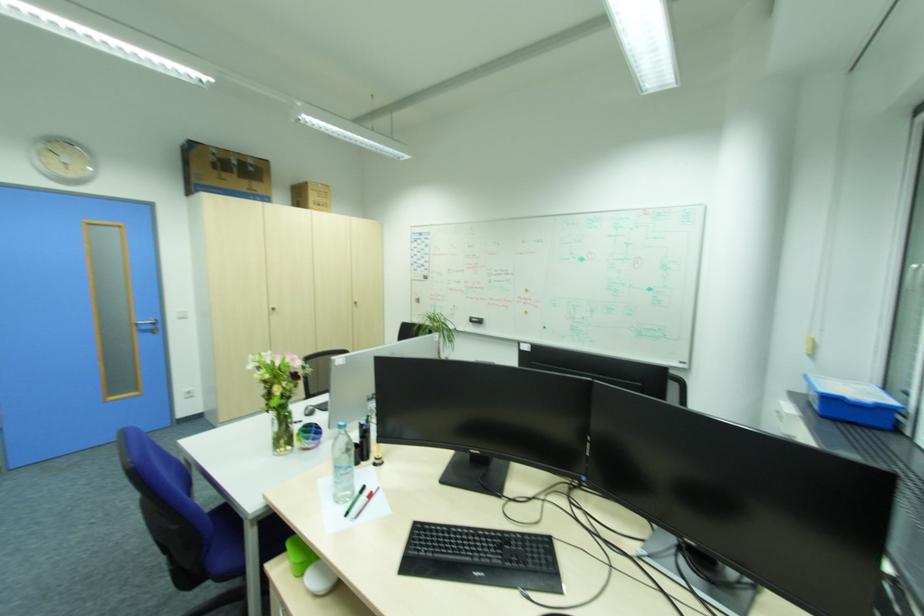
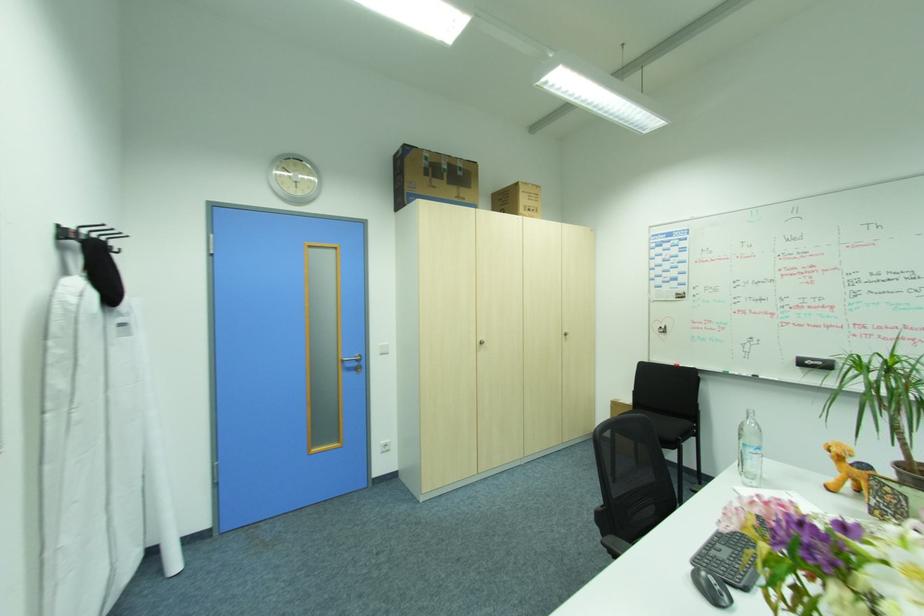
Question: I am providing you with two images of the same scene from different viewpoints. After the viewpoint changes to image2, which objects are now occluded?

Choices:
 (A) stuffed animal toy
 (B) whiteboard eraser
 (C) computer mouse
 (D) none of these

Answer: (D)